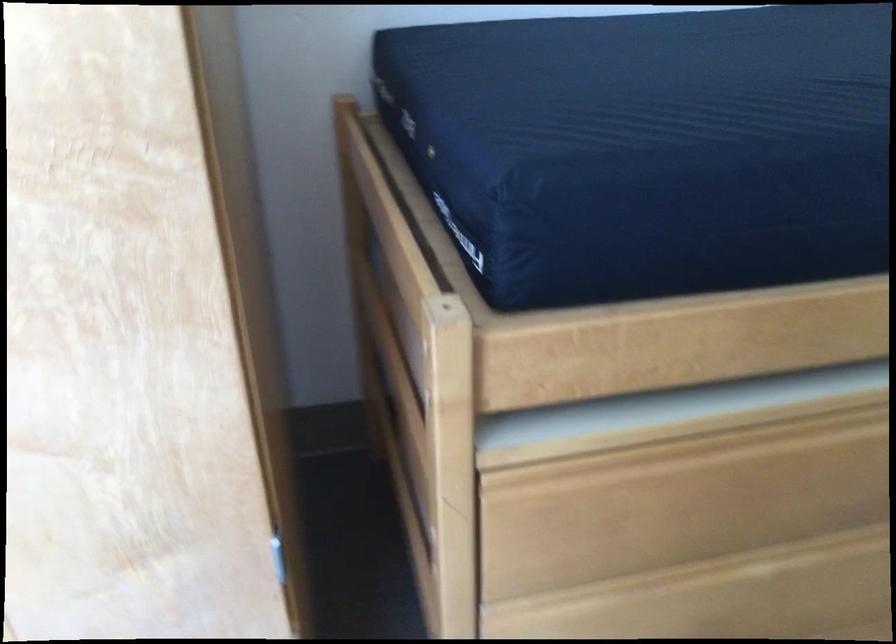
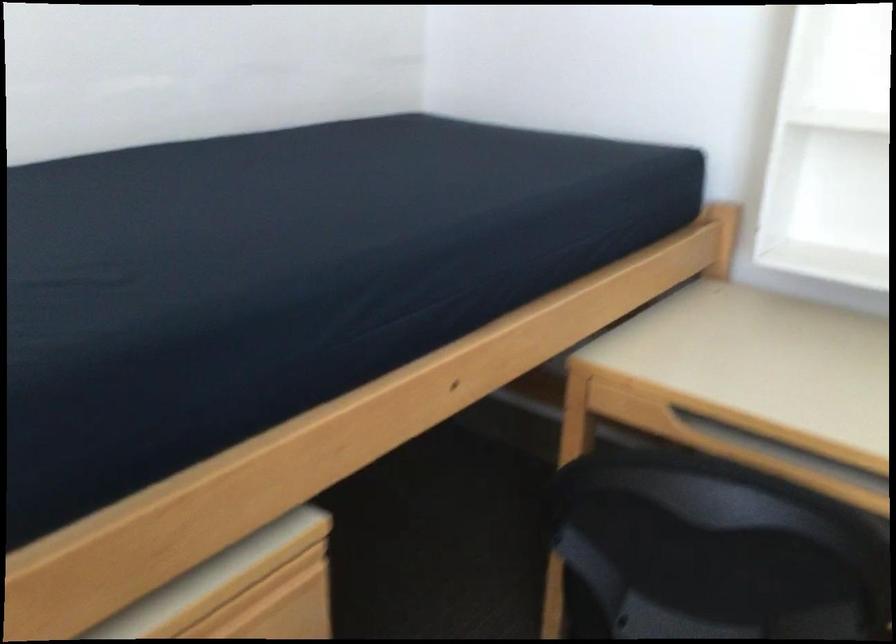
Question: Based on the continuous images, in which direction is the camera rotating? Reply with the corresponding letter.

Choices:
 (A) Left
 (B) Right
 (C) Up
 (D) Down

Answer: (B)